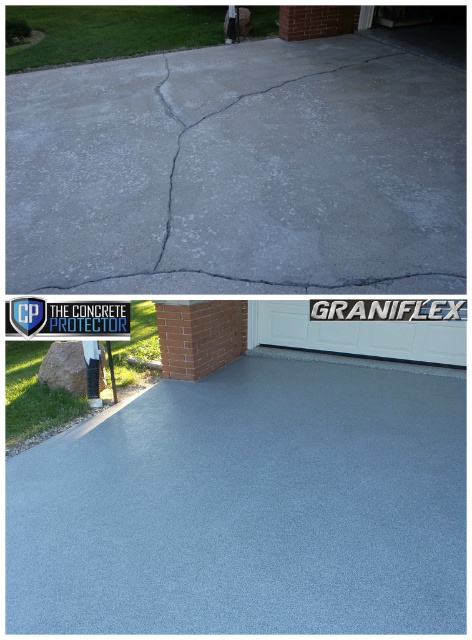
You are a contractor assessing the driveway before and after treatment. In the top section, you notice the gray concrete at upper center and the white plastic sign at upper center. Which object is narrower in width?

The gray concrete at upper center is narrower in width than the white plastic sign at upper center according to the description.

You are a contractor reviewing the before and after images of a driveway. In the top section, you see the gray concrete crack at upper center. Where exactly is this crack located in the top section?

The gray concrete crack at upper center is located at the 2D coordinates point (276, 161) in the top section.